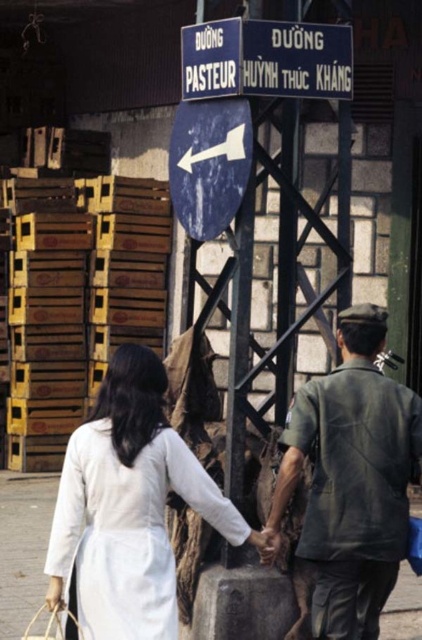
You are a tourist in Vietnam and see the blue painted metal sign at upper center and the blue matte sign at center. Which one is positioned to the right of the other?

The blue painted metal sign at upper center is positioned to the right of the blue matte sign at center.

You are a tourist in Vietnam and see the dark green uniform at center and the blue matte sign at center. Which object is wider?

The dark green uniform at center is wider than the blue matte sign at center.

You are a tourist in Vietnam and see the white cotton ao dai at center. If you want to take a photo of it from the front, which direction should you move relative to the current position?

The white cotton ao dai at center is positioned at point (129,506). To take a photo from the front, you should move to the front side of the white cotton ao dai at center, which would be the direction opposite to where it is facing. However, without knowing its facing direction, it is advisable to approach from the front as indicated by its position in the scene.